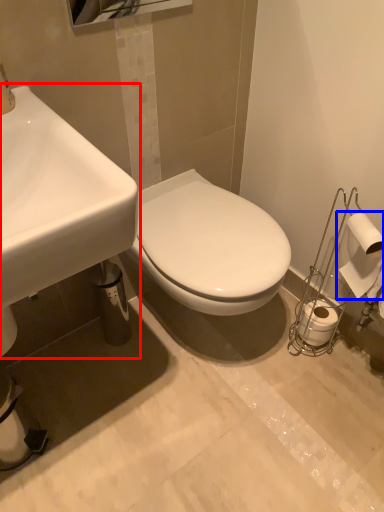
Question: Which of the following is the closest to the observer, sink (highlighted by a red box) or toilet paper (highlighted by a blue box)?

Choices:
 (A) sink
 (B) toilet paper

Answer: (A)